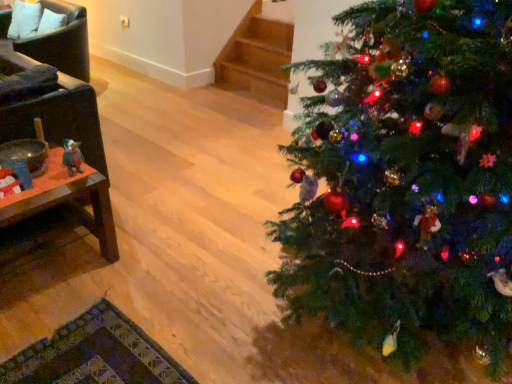
Question: From the image's perspective, relative to white fabric pillow at upper left, is green plush toy at left above or below?

Choices:
 (A) below
 (B) above

Answer: (A)

Question: In the image, is green plush toy at left positioned in front of or behind white fabric pillow at upper left?

Choices:
 (A) behind
 (B) front

Answer: (B)

Question: Based on their relative distances, which object is nearer to the dark brown leather armchair at left, the 1th armchair viewed from the front?

Choices:
 (A) woodenmaterial/texturetable at left
 (B) white fabric pillow at upper left
 (C) leather armchair at left, acting as the first armchair starting from the back
 (D) green matte christmas tree at right
 (E) green plush toy at left

Answer: (A)

Question: Based on their relative distances, which object is nearer to the green matte christmas tree at right?

Choices:
 (A) green plush toy at left
 (B) leather armchair at left, the 2th armchair positioned from the front
 (C) white fabric pillow at upper left
 (D) dark brown leather armchair at left, which appears as the 2th armchair when viewed from the top
 (E) woodenmaterial/texturetable at left

Answer: (E)